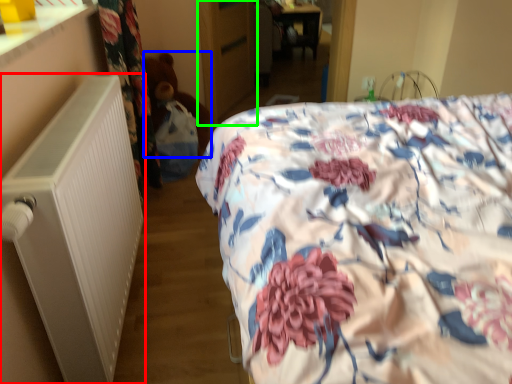
Question: Considering the real-world distances, which object is closest to radiator (highlighted by a red box)? teddy (highlighted by a blue box) or armoire (highlighted by a green box).

Choices:
 (A) teddy
 (B) armoire

Answer: (A)